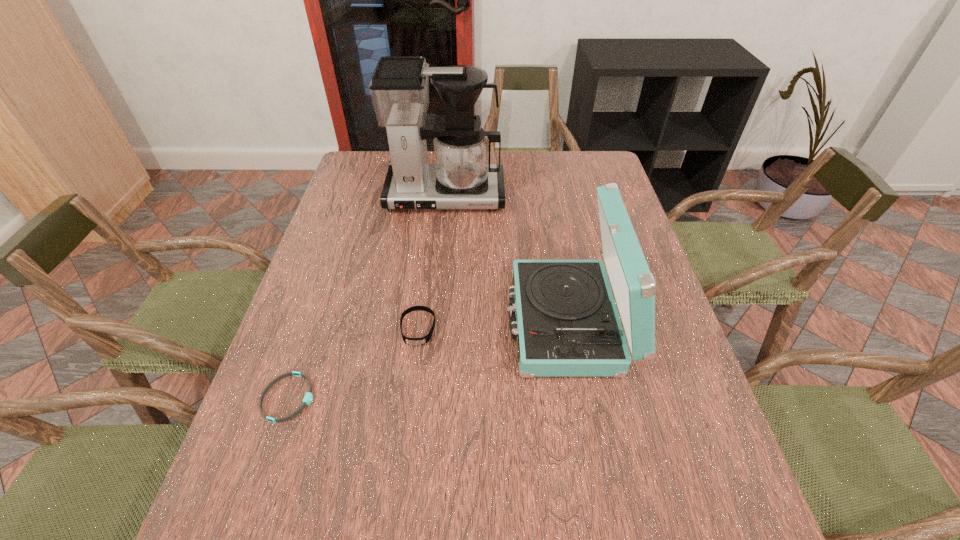
You are a GUI agent. You are given a task and a screenshot of the screen. Output one action in this format:
    pyautogui.click(x=<x>, y=<y>)
    Task: Click on the vacant area between the second shortest object and the nearer wristband
    This screenshot has height=540, width=960.
    Given the screenshot: What is the action you would take?
    pyautogui.click(x=353, y=363)

This screenshot has height=540, width=960. In order to click on vacant area that lies between the farthest object and the taller wristband in this screenshot , I will do `click(431, 262)`.

I want to click on vacant space that is in between the second shortest object and the farthest object, so click(x=431, y=262).

Locate which object is the second closest to the third shortest object. Please provide its 2D coordinates. Your answer should be formatted as a tuple, i.e. [(x, y)], where the tuple contains the x and y coordinates of a point satisfying the conditions above.

[(462, 177)]

Where is `the closest object relative to the shortest object`? The height and width of the screenshot is (540, 960). the closest object relative to the shortest object is located at coordinates (411, 341).

The image size is (960, 540). I want to click on vacant space that satisfies the following two spatial constraints: 1. at the front of the farthest object where the controls are located; 2. on the buckle of the shortest object, so click(425, 398).

You are a GUI agent. You are given a task and a screenshot of the screen. Output one action in this format:
    pyautogui.click(x=<x>, y=<y>)
    Task: Click on the vacant space that satisfies the following two spatial constraints: 1. on the display of the third tallest object; 2. on the buckle of the shorter wristband
    
    Given the screenshot: What is the action you would take?
    pyautogui.click(x=409, y=398)